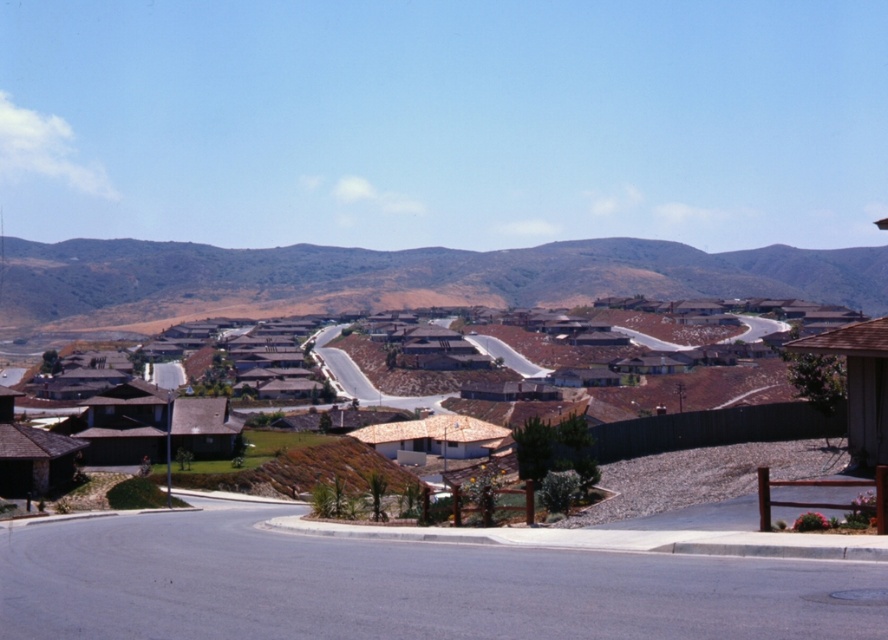
You are standing at the point marked by the coordinates (398, 278) in the image. What is the immediate terrain feature you are standing on?

The immediate terrain feature at point (398, 278) is a brown dry grassy hillside.